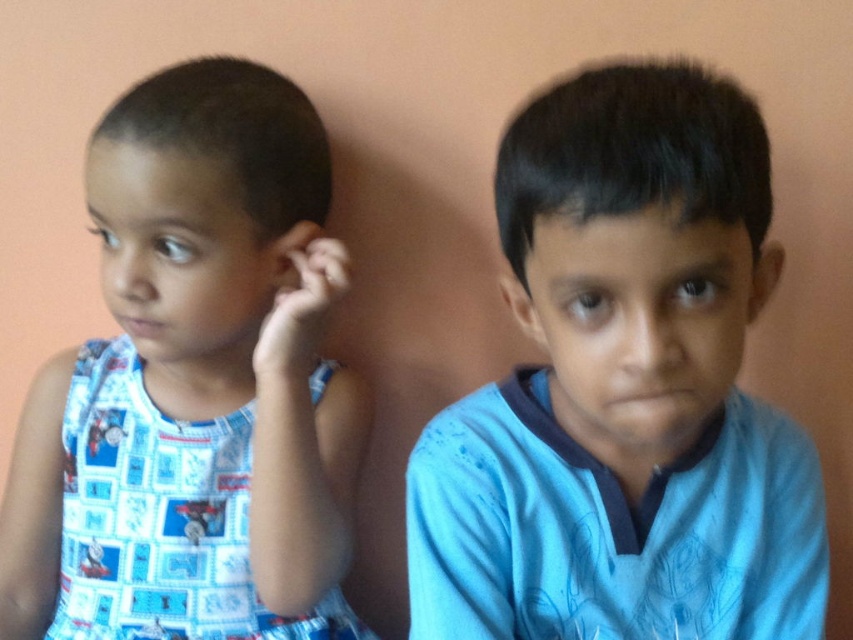
You are a photographer setting up for a group photo. You need to arrange two children so that the child wearing the blue printed dress at left is to the left of the child in the blue cotton shirt at right. Based on the current arrangement shown in the image, is this requirement already met?

Yes, the requirement is already met because the blue printed dress at left is positioned on the left side of the blue cotton shirt at right.

You are a photographer trying to capture a closeup of the blue cotton shirt at right and the smooth skin ear at center. Since you want to focus on both objects equally, which one should you adjust your camera to prioritize focusing on first?

The blue cotton shirt at right is positioned on the right side of smooth skin ear at center, so you should prioritize focusing on the smooth skin ear at center first since it is closer to the camera.

You are a photographer setting up for a portrait. You need to ensure that the blue cotton shirt at right and the smooth skin ear at center are both visible in the frame. Based on their positions, which object is lower in the image?

The blue cotton shirt at right is below the smooth skin ear at center, so the blue cotton shirt at right is lower in the image.